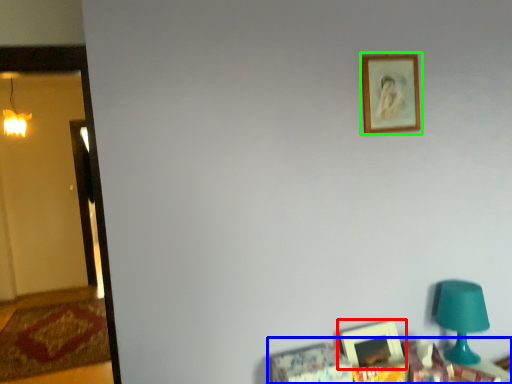
Question: Considering the real-world distances, which object is closest to picture frame (highlighted by a red box)? furniture (highlighted by a blue box) or picture frame (highlighted by a green box).

Choices:
 (A) furniture
 (B) picture frame

Answer: (A)